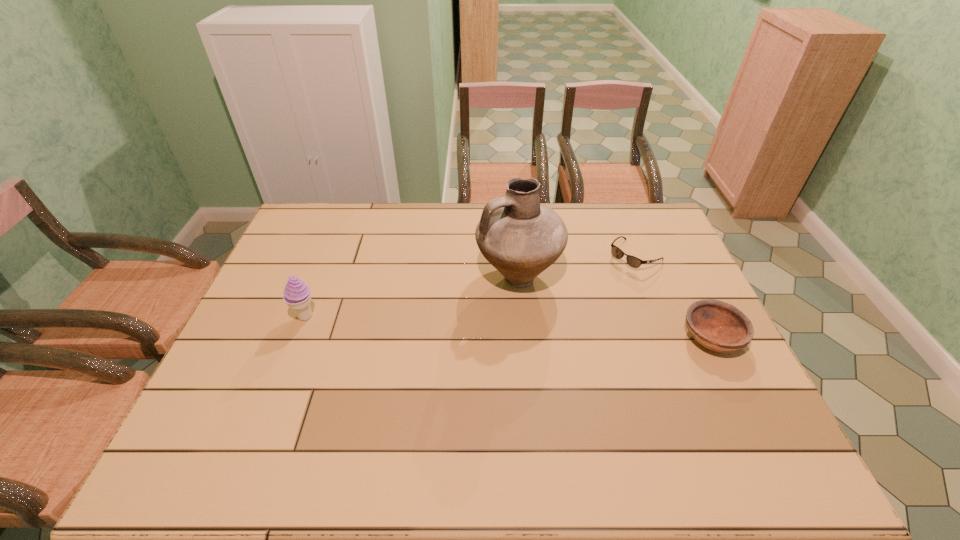
Where is `free spot between the third object from right to left and the shortest object`? This screenshot has width=960, height=540. free spot between the third object from right to left and the shortest object is located at coordinates (577, 266).

The height and width of the screenshot is (540, 960). Identify the location of free space between the third object from right to left and the sunglasses. (577, 266).

What are the coordinates of `blank region between the sunglasses and the bowl` in the screenshot? It's located at (673, 296).

Locate an element on the screen. This screenshot has width=960, height=540. free area in between the icecream and the third tallest object is located at coordinates (509, 327).

Locate an element on the screen. Image resolution: width=960 pixels, height=540 pixels. unoccupied position between the pitcher and the sunglasses is located at coordinates (577, 266).

At what (x,y) coordinates should I click in order to perform the action: click on object that is the second closest one to the sunglasses. Please return your answer as a coordinate pair (x, y). This screenshot has width=960, height=540. Looking at the image, I should click on (721, 327).

This screenshot has width=960, height=540. I want to click on object that stands as the third closest to the sunglasses, so click(297, 295).

Where is `free space that satisfies the following two spatial constraints: 1. on the back side of the leftmost object; 2. on the right side of the pitcher`? free space that satisfies the following two spatial constraints: 1. on the back side of the leftmost object; 2. on the right side of the pitcher is located at coordinates (321, 276).

You are a GUI agent. You are given a task and a screenshot of the screen. Output one action in this format:
    pyautogui.click(x=<x>, y=<y>)
    Task: Click on the free space that satisfies the following two spatial constraints: 1. on the back side of the third shortest object; 2. on the left side of the second object from left to right
    Image resolution: width=960 pixels, height=540 pixels.
    Given the screenshot: What is the action you would take?
    pyautogui.click(x=321, y=276)

Locate an element on the screen. Image resolution: width=960 pixels, height=540 pixels. vacant position in the image that satisfies the following two spatial constraints: 1. on the back side of the tallest object; 2. on the left side of the leftmost object is located at coordinates (321, 276).